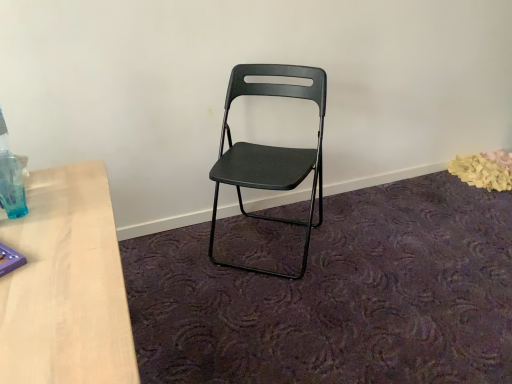
Question: From a real-world perspective, is matte black folding chair at center on translucent blue plastic bottle at left?

Choices:
 (A) no
 (B) yes

Answer: (A)

Question: Is translucent blue plastic bottle at left completely or partially inside matte black folding chair at center?

Choices:
 (A) yes
 (B) no

Answer: (B)

Question: From a real-world perspective, is matte black folding chair at center beneath translucent blue plastic bottle at left?

Choices:
 (A) no
 (B) yes

Answer: (B)

Question: Does matte black folding chair at center have a greater width compared to translucent blue plastic bottle at left?

Choices:
 (A) no
 (B) yes

Answer: (B)

Question: Is matte black folding chair at center not near translucent blue plastic bottle at left?

Choices:
 (A) yes
 (B) no

Answer: (B)

Question: Is matte black folding chair at center not inside translucent blue plastic bottle at left?

Choices:
 (A) no
 (B) yes

Answer: (B)

Question: From the image's perspective, would you say translucent blue plastic bottle at left is shown under matte black folding chair at center?

Choices:
 (A) no
 (B) yes

Answer: (B)

Question: From a real-world perspective, is translucent blue plastic bottle at left over matte black folding chair at center?

Choices:
 (A) no
 (B) yes

Answer: (B)

Question: From the image's perspective, is translucent blue plastic bottle at left located above matte black folding chair at center?

Choices:
 (A) yes
 (B) no

Answer: (B)

Question: Considering the relative positions of translucent blue plastic bottle at left and matte black folding chair at center in the image provided, is translucent blue plastic bottle at left to the left of matte black folding chair at center from the viewer's perspective?

Choices:
 (A) yes
 (B) no

Answer: (A)

Question: Is translucent blue plastic bottle at left not inside matte black folding chair at center?

Choices:
 (A) no
 (B) yes

Answer: (B)

Question: Is translucent blue plastic bottle at left facing away from matte black folding chair at center?

Choices:
 (A) yes
 (B) no

Answer: (B)

Question: Is point (6, 198) closer or farther from the camera than point (309, 92)?

Choices:
 (A) closer
 (B) farther

Answer: (A)